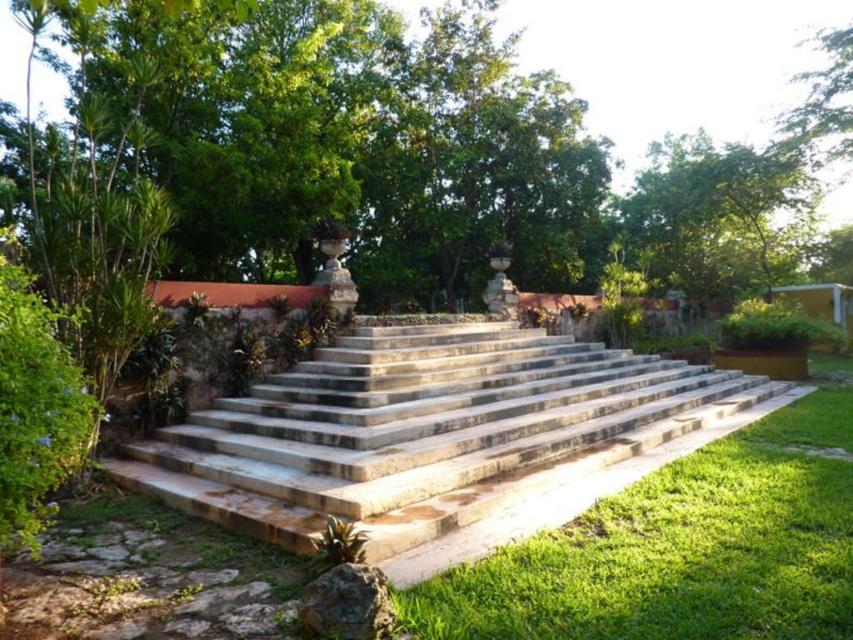
Question: Does natural stone stairs at center have a smaller size compared to green grass at lower center?

Choices:
 (A) yes
 (B) no

Answer: (B)

Question: Estimate the real-world distances between objects in this image. Which object is closer to the green leafy tree at upper right?

Choices:
 (A) natural stone stairs at center
 (B) green grass at lower center

Answer: (A)

Question: Is green grass at lower center behind green leafy tree at upper right?

Choices:
 (A) yes
 (B) no

Answer: (B)

Question: Is natural stone stairs at center to the left of green grass at lower center from the viewer's perspective?

Choices:
 (A) no
 (B) yes

Answer: (B)

Question: Which object is the farthest from the natural stone stairs at center?

Choices:
 (A) green leafy tree at upper right
 (B) green grass at lower center

Answer: (A)

Question: Which object is the farthest from the natural stone stairs at center?

Choices:
 (A) green grass at lower center
 (B) green leafy tree at upper right

Answer: (B)